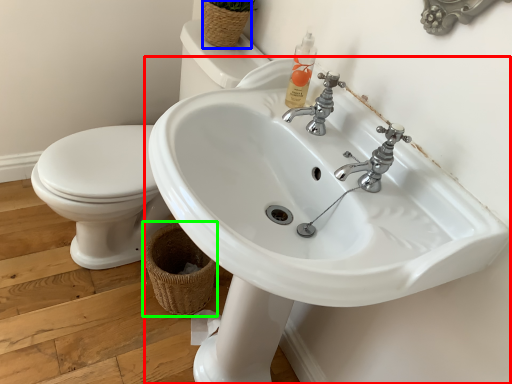
Question: Based on their relative distances, which object is farther from sink (highlighted by a red box)? Choose from basket (highlighted by a blue box) and basket (highlighted by a green box).

Choices:
 (A) basket
 (B) basket

Answer: (A)